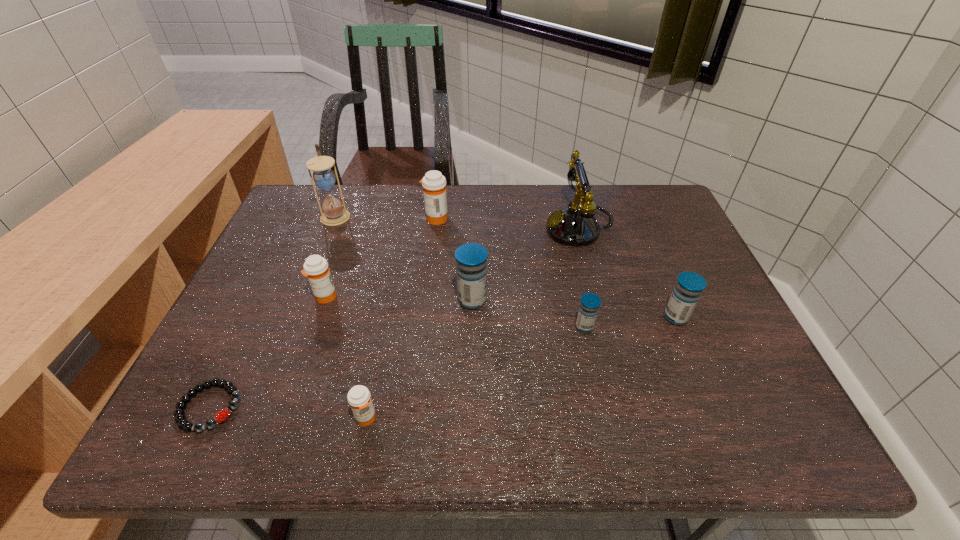
You are a GUI agent. You are given a task and a screenshot of the screen. Output one action in this format:
    pyautogui.click(x=<x>, y=<y>)
    Task: Click on the hourglass
    This screenshot has width=960, height=540.
    Given the screenshot: What is the action you would take?
    [324, 177]

Find the location of a particular element. The height and width of the screenshot is (540, 960). black telephone is located at coordinates (575, 225).

Identify the location of the biggest orange medicine. (434, 183).

The height and width of the screenshot is (540, 960). What are the coordinates of `the farthest orange medicine` in the screenshot? It's located at (434, 183).

This screenshot has height=540, width=960. Identify the location of the leftmost blue medicine. (471, 258).

Where is `the biggest blue medicine`? Image resolution: width=960 pixels, height=540 pixels. the biggest blue medicine is located at coordinates (471, 258).

This screenshot has height=540, width=960. What are the coordinates of `the leftmost orange medicine` in the screenshot? It's located at (316, 269).

Image resolution: width=960 pixels, height=540 pixels. In order to click on the second smallest orange medicine in this screenshot , I will do `click(316, 269)`.

At what (x,y) coordinates should I click in order to perform the action: click on the second smallest blue medicine. Please return your answer as a coordinate pair (x, y). Looking at the image, I should click on (689, 286).

Identify the location of the rightmost blue medicine. 689,286.